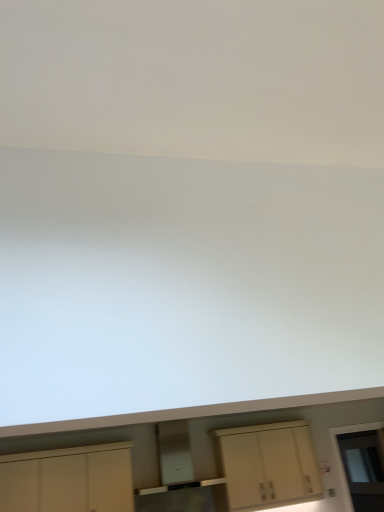
Question: From a real-world perspective, is white matte cabinet at lower left, acting as the second cabinetry starting from the right, positioned above or below matte cream cabinet at center, which is counted as the first cabinetry, starting from the right?

Choices:
 (A) below
 (B) above

Answer: (B)

Question: Would you say white matte cabinet at lower left, acting as the second cabinetry starting from the right, is to the left or to the right of matte cream cabinet at center, the 2th cabinetry positioned from the left, in the picture?

Choices:
 (A) left
 (B) right

Answer: (A)

Question: Which object is the farthest from the transparent glass door at lower right?

Choices:
 (A) matte cream cabinet at center, which is counted as the first cabinetry, starting from the right
 (B) white matte cabinet at lower left, which ranks as the 1th cabinetry in left-to-right order

Answer: (B)

Question: Which is nearer to the matte cream cabinet at center, the 2th cabinetry positioned from the left?

Choices:
 (A) transparent glass door at lower right
 (B) white matte cabinet at lower left, which ranks as the 1th cabinetry in left-to-right order

Answer: (A)